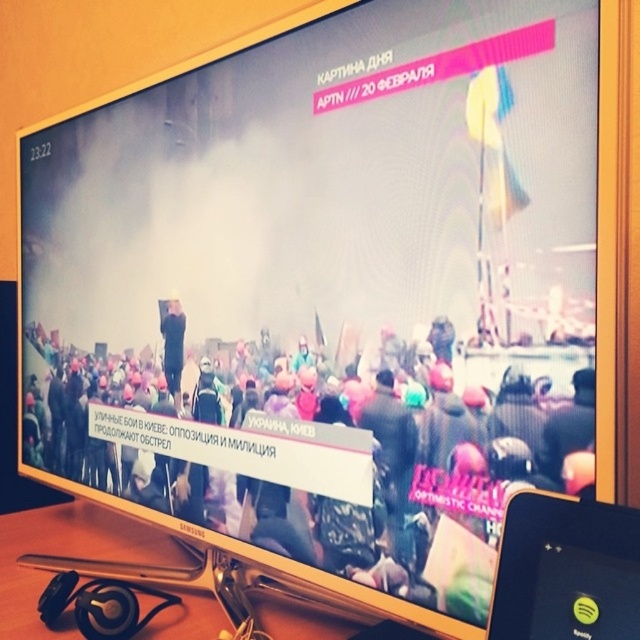
You are a news analyst watching this TV broadcast. The multicolored fabric crowd at center is shown in the image. Based on the coordinates provided, where exactly is the crowd located on the screen?

The multicolored fabric crowd at center is located at coordinates point (310, 451) on the screen.

You are a news analyst watching this TV broadcast. The scene shows a protest with a multicolored fabric crowd at center and a dark blue uniform at center. Based on their sizes in the image, which group is closer to the camera?

The multicolored fabric crowd at center is taller than the dark blue uniform at center, so the multicolored fabric crowd at center is closer to the camera.

You are a journalist trying to capture a photo of the protest scene displayed on the TV screen. You have a matte black phone at lower right and a dark blue uniform at center. Which object is shorter in height?

The matte black phone at lower right is shorter than the dark blue uniform at center.